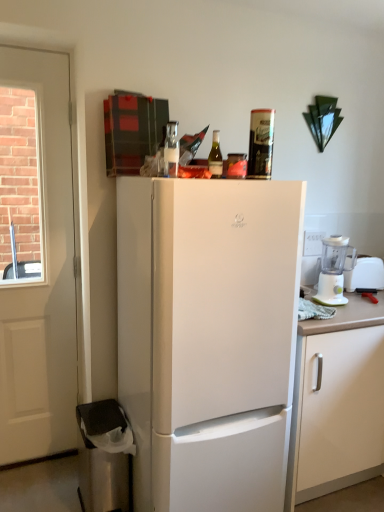
Question: From a real-world perspective, is green glass bottle at top, which appears as the first bottle when viewed from the right, on top of clear glass bottle at upper center, which is the second bottle in right-to-left order?

Choices:
 (A) yes
 (B) no

Answer: (B)

Question: Can you confirm if green glass bottle at top, which appears as the first bottle when viewed from the right, is wider than clear glass bottle at upper center, the first bottle in the left-to-right sequence?

Choices:
 (A) no
 (B) yes

Answer: (B)

Question: Considering the relative positions of green glass bottle at top, which appears as the first bottle when viewed from the right, and clear glass bottle at upper center, which is the second bottle in right-to-left order, in the image provided, is green glass bottle at top, which appears as the first bottle when viewed from the right, to the right of clear glass bottle at upper center, which is the second bottle in right-to-left order, from the viewer's perspective?

Choices:
 (A) yes
 (B) no

Answer: (A)

Question: Can you confirm if green glass bottle at top, which appears as the first bottle when viewed from the right, is taller than clear glass bottle at upper center, which is the second bottle in right-to-left order?

Choices:
 (A) no
 (B) yes

Answer: (A)

Question: Is green glass bottle at top, which appears as the first bottle when viewed from the right, with clear glass bottle at upper center, the first bottle in the left-to-right sequence?

Choices:
 (A) no
 (B) yes

Answer: (A)

Question: Is white matte refrigerator at center situated inside white plastic blender at right or outside?

Choices:
 (A) outside
 (B) inside

Answer: (A)

Question: Looking at their shapes, would you say white matte refrigerator at center is wider or thinner than white plastic blender at right?

Choices:
 (A) wide
 (B) thin

Answer: (A)

Question: Would you say white matte refrigerator at center is to the left or to the right of white plastic blender at right in the picture?

Choices:
 (A) right
 (B) left

Answer: (B)

Question: Is white matte refrigerator at center taller or shorter than white plastic blender at right?

Choices:
 (A) tall
 (B) short

Answer: (A)

Question: From the image's perspective, is white matte refrigerator at center positioned above or below white plastic blender at right?

Choices:
 (A) above
 (B) below

Answer: (B)

Question: From a real-world perspective, is white matte refrigerator at center positioned above or below white plastic blender at right?

Choices:
 (A) above
 (B) below

Answer: (B)

Question: Choose the correct answer: Is white matte refrigerator at center inside white plastic blender at right or outside it?

Choices:
 (A) inside
 (B) outside

Answer: (B)

Question: Considering the positions of point (220, 316) and point (336, 273), is point (220, 316) closer or farther from the camera than point (336, 273)?

Choices:
 (A) closer
 (B) farther

Answer: (A)

Question: Is point (56, 259) positioned closer to the camera than point (345, 275)?

Choices:
 (A) farther
 (B) closer

Answer: (B)

Question: Based on their sizes in the image, would you say white wooden door at left is bigger or smaller than white plastic blender at right?

Choices:
 (A) small
 (B) big

Answer: (B)